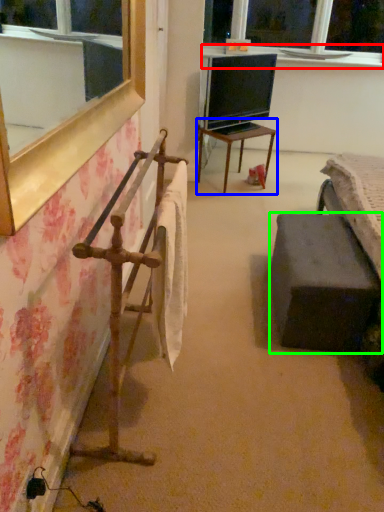
Question: Considering the real-world distances, which object is farthest from window sill (highlighted by a red box)? table (highlighted by a blue box) or furniture (highlighted by a green box)?

Choices:
 (A) table
 (B) furniture

Answer: (B)